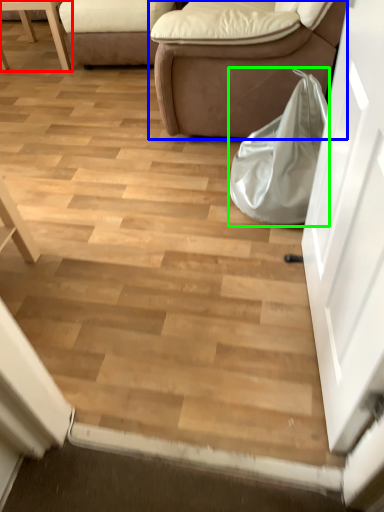
Question: Considering the real-world distances, which object is closest to furniture (highlighted by a red box)? studio couch (highlighted by a blue box) or bag (highlighted by a green box).

Choices:
 (A) studio couch
 (B) bag

Answer: (A)